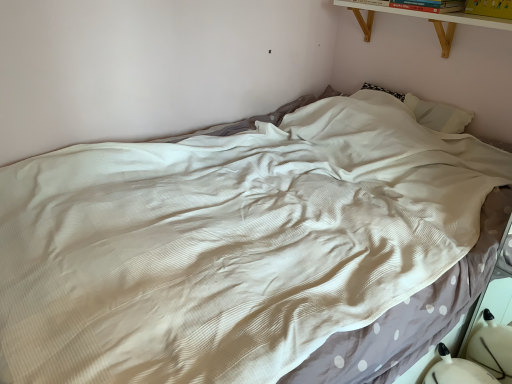
Question: Does yellow paper at upper right, which is counted as the 2th book, starting from the left, come behind hardcover book at upper right, arranged as the 1th book when viewed from the left?

Choices:
 (A) yes
 (B) no

Answer: (B)

Question: Does yellow paper at upper right, the 1th book from the right, have a greater height compared to hardcover book at upper right, arranged as the 1th book when viewed from the left?

Choices:
 (A) yes
 (B) no

Answer: (A)

Question: From a real-world perspective, does yellow paper at upper right, the 1th book from the right, sit lower than hardcover book at upper right, arranged as the 1th book when viewed from the left?

Choices:
 (A) no
 (B) yes

Answer: (A)

Question: From the image's perspective, would you say yellow paper at upper right, the 1th book from the right, is positioned over hardcover book at upper right, arranged as the 1th book when viewed from the left?

Choices:
 (A) no
 (B) yes

Answer: (A)

Question: Is yellow paper at upper right, which is counted as the 2th book, starting from the left, positioned in front of hardcover book at upper right, arranged as the 1th book when viewed from the left?

Choices:
 (A) yes
 (B) no

Answer: (A)

Question: Is yellow paper at upper right, the 1th book from the right, oriented towards hardcover book at upper right, the 2th book positioned from the right?

Choices:
 (A) no
 (B) yes

Answer: (A)

Question: From the image's perspective, does hardcover book at upper right, arranged as the 1th book when viewed from the left, appear higher than yellow paper at upper right, which is counted as the 2th book, starting from the left?

Choices:
 (A) no
 (B) yes

Answer: (B)

Question: Is hardcover book at upper right, the 2th book positioned from the right, positioned behind yellow paper at upper right, the 1th book from the right?

Choices:
 (A) no
 (B) yes

Answer: (B)

Question: Considering the relative sizes of hardcover book at upper right, arranged as the 1th book when viewed from the left, and yellow paper at upper right, which is counted as the 2th book, starting from the left, in the image provided, is hardcover book at upper right, arranged as the 1th book when viewed from the left, bigger than yellow paper at upper right, which is counted as the 2th book, starting from the left,?

Choices:
 (A) no
 (B) yes

Answer: (B)

Question: Is hardcover book at upper right, the 2th book positioned from the right, thinner than yellow paper at upper right, the 1th book from the right?

Choices:
 (A) yes
 (B) no

Answer: (B)

Question: From a real-world perspective, is hardcover book at upper right, arranged as the 1th book when viewed from the left, below yellow paper at upper right, which is counted as the 2th book, starting from the left?

Choices:
 (A) yes
 (B) no

Answer: (A)

Question: Does hardcover book at upper right, the 2th book positioned from the right, have a lesser height compared to yellow paper at upper right, which is counted as the 2th book, starting from the left?

Choices:
 (A) no
 (B) yes

Answer: (B)

Question: Is yellow paper at upper right, the 1th book from the right, outside white wood shelf at upper right?

Choices:
 (A) yes
 (B) no

Answer: (A)